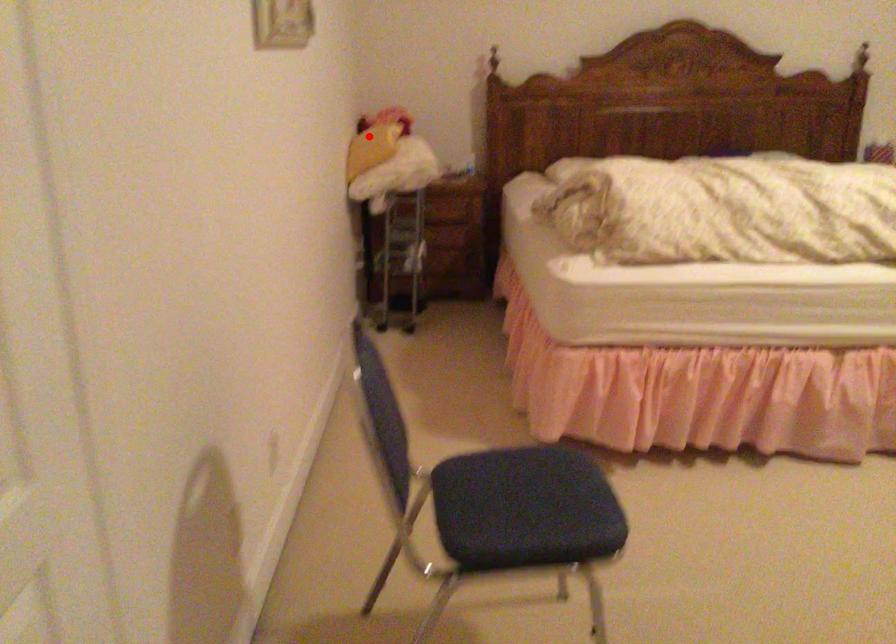
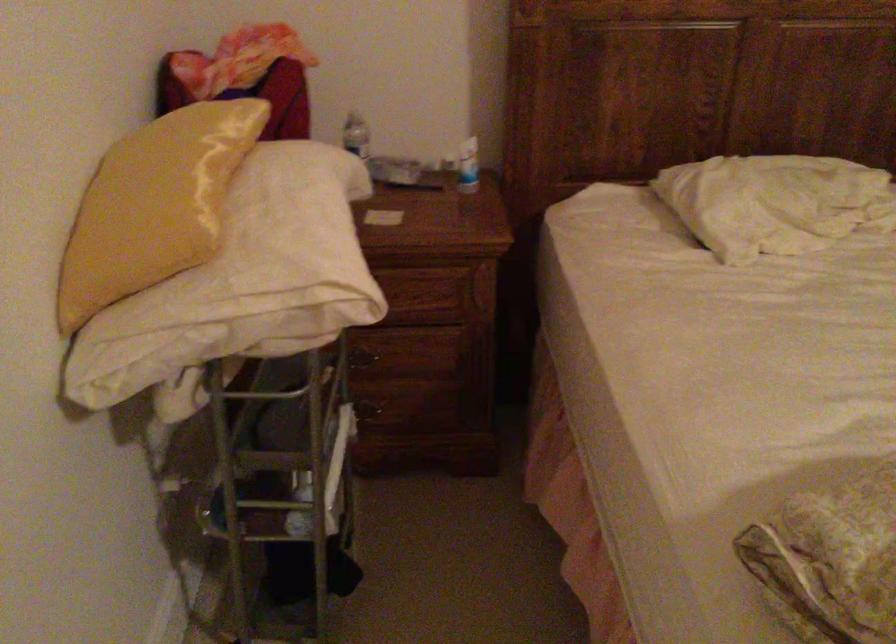
Question: I am providing you with two images of the same scene from different viewpoints. A red point is marked on the first image. At the location where the point appears in image 1, is it still visible in image 2?

Choices:
 (A) Yes
 (B) No

Answer: (A)